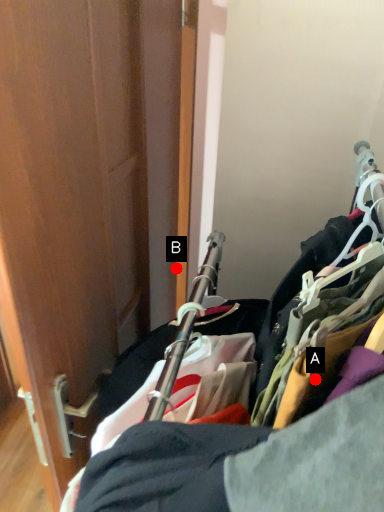
Question: Two points are circled on the image, labeled by A and B beside each circle. Which point appears closest to the camera in this image?

Choices:
 (A) A is closer
 (B) B is closer

Answer: (A)